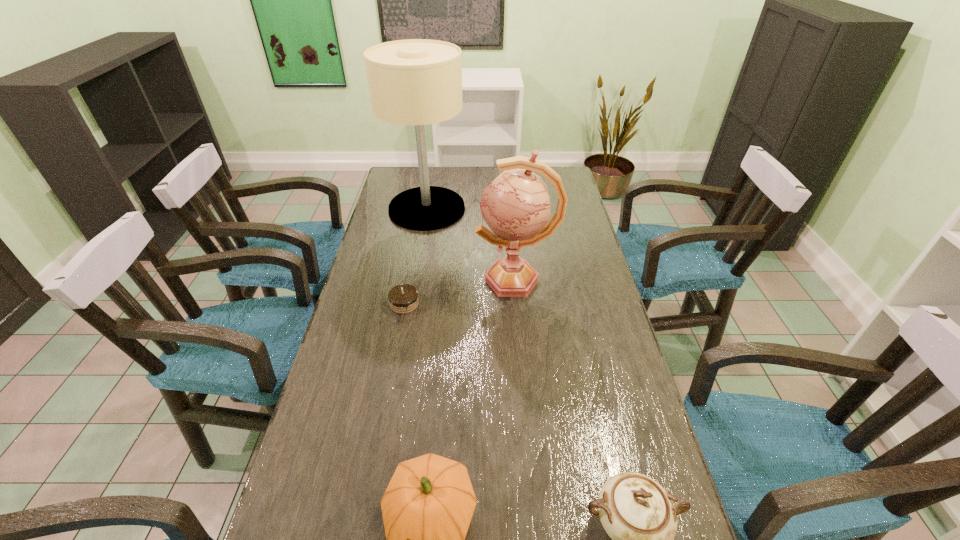
In order to click on the farthest object in this screenshot , I will do `click(417, 82)`.

Locate an element on the screen. This screenshot has height=540, width=960. table lamp is located at coordinates click(x=417, y=82).

The height and width of the screenshot is (540, 960). In order to click on the second tallest object in this screenshot , I will do `click(516, 205)`.

Find the location of a particular element. chocolate cake is located at coordinates (403, 299).

The width and height of the screenshot is (960, 540). Identify the location of free space located 0.060m on the back of the tallest object. (431, 183).

At what (x,y) coordinates should I click in order to perform the action: click on free space located 0.380m on the front-facing side of the globe. Please return your answer as a coordinate pair (x, y). This screenshot has width=960, height=540. Looking at the image, I should click on (357, 280).

You are a GUI agent. You are given a task and a screenshot of the screen. Output one action in this format:
    pyautogui.click(x=<x>, y=<y>)
    Task: Click on the vacant point located on the front-facing side of the globe
    This screenshot has height=540, width=960.
    Given the screenshot: What is the action you would take?
    pyautogui.click(x=372, y=280)

In order to click on vacant space located on the front-facing side of the globe in this screenshot , I will do [370, 280].

Where is `free region located 0.120m on the left of the shortest object`? This screenshot has height=540, width=960. free region located 0.120m on the left of the shortest object is located at coordinates (350, 304).

Locate an element on the screen. The width and height of the screenshot is (960, 540). object located at the far edge is located at coordinates pos(417,82).